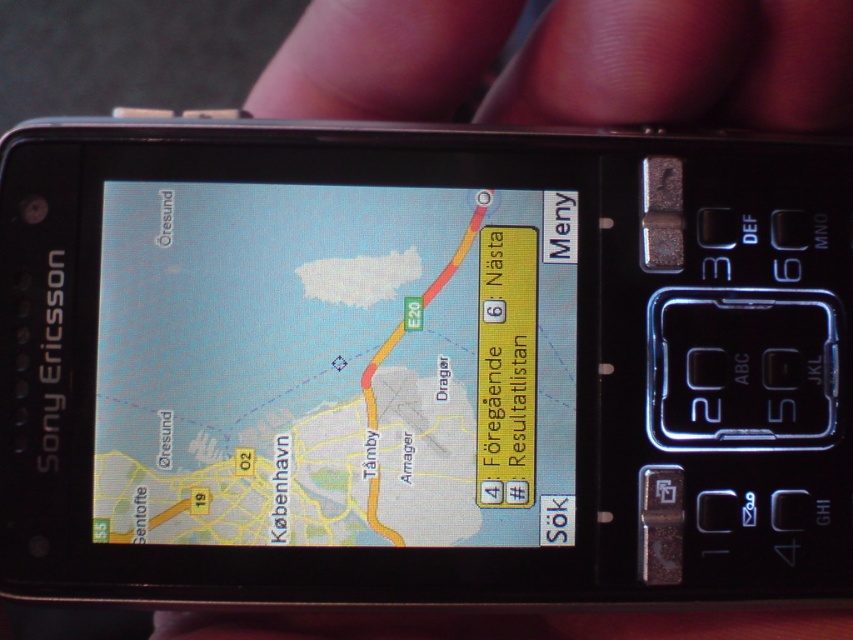
Question: Is matte plastic navigation screen at center to the right of pink flesh at upper center from the viewer's perspective?

Choices:
 (A) no
 (B) yes

Answer: (A)

Question: Can you confirm if matte plastic navigation screen at center is positioned to the right of pink flesh at upper center?

Choices:
 (A) no
 (B) yes

Answer: (A)

Question: Among these objects, which one is nearest to the camera?

Choices:
 (A) pink flesh at upper center
 (B) matte plastic navigation screen at center

Answer: (A)

Question: In this image, where is matte plastic navigation screen at center located relative to pink flesh at upper center?

Choices:
 (A) above
 (B) below

Answer: (B)

Question: Which of the following is the closest to the observer?

Choices:
 (A) (440, 365)
 (B) (432, 93)

Answer: (A)

Question: Which point appears farthest from the camera in this image?

Choices:
 (A) (212, 481)
 (B) (810, 6)

Answer: (A)